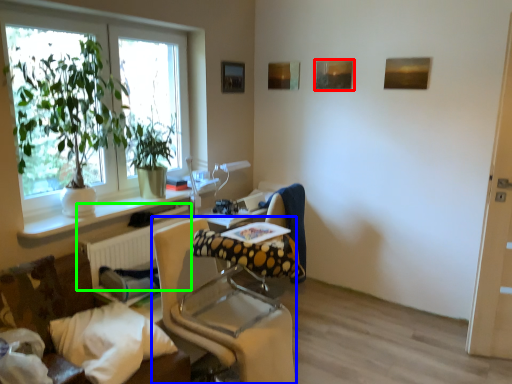
Question: Which object is positioned closest to picture frame (highlighted by a red box)? Select from chair (highlighted by a blue box) and radiator (highlighted by a green box).

Choices:
 (A) chair
 (B) radiator

Answer: (B)